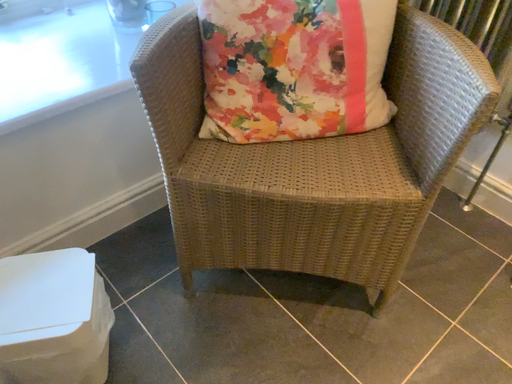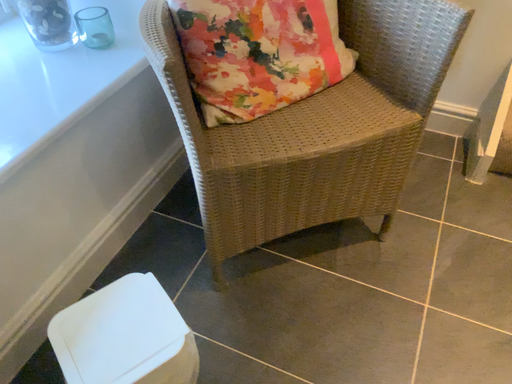
Question: How did the camera likely rotate when shooting the video?

Choices:
 (A) rotated right
 (B) rotated left

Answer: (A)